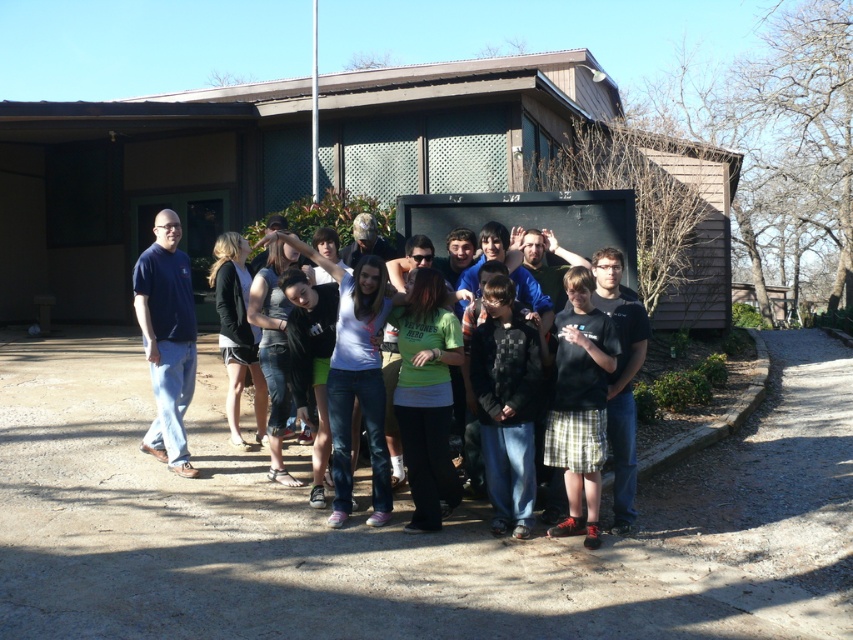
Question: Which object appears farthest from the camera in this image?

Choices:
 (A) metallic flag pole at upper center
 (B) black cotton shirt at center

Answer: (A)

Question: Observing the image, what is the correct spatial positioning of black cotton shirt at center in reference to metallic flag pole at upper center?

Choices:
 (A) right
 (B) left

Answer: (A)

Question: Can you confirm if black cotton shirt at center is thinner than metallic flag pole at upper center?

Choices:
 (A) no
 (B) yes

Answer: (B)

Question: Can you confirm if black cotton shirt at center is thinner than metallic flag pole at upper center?

Choices:
 (A) yes
 (B) no

Answer: (A)

Question: Which object is farther from the camera taking this photo?

Choices:
 (A) metallic flag pole at upper center
 (B) black cotton shirt at center

Answer: (A)

Question: Which object is farther from the camera taking this photo?

Choices:
 (A) black cotton shirt at center
 (B) dark blue jeans at center
 (C) metallic flag pole at upper center

Answer: (C)